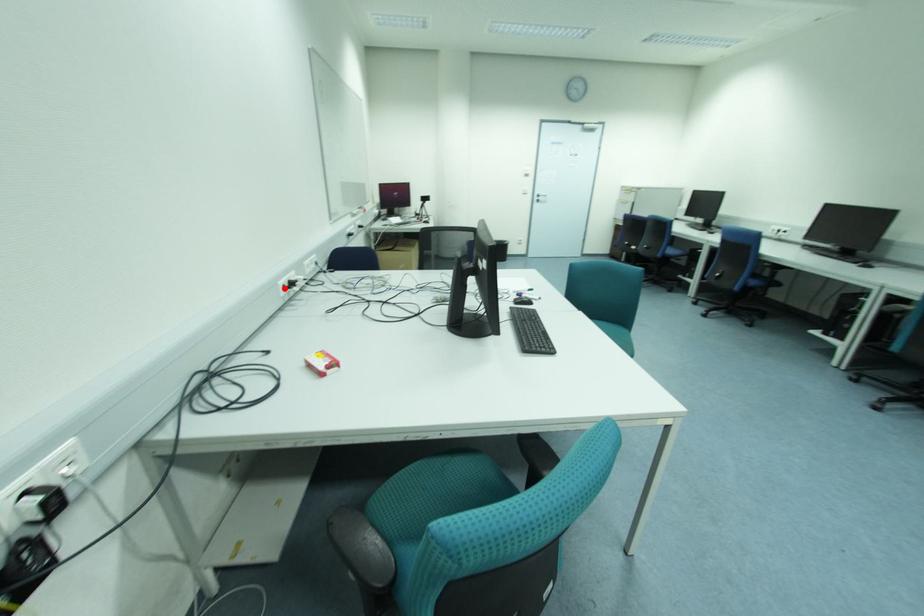
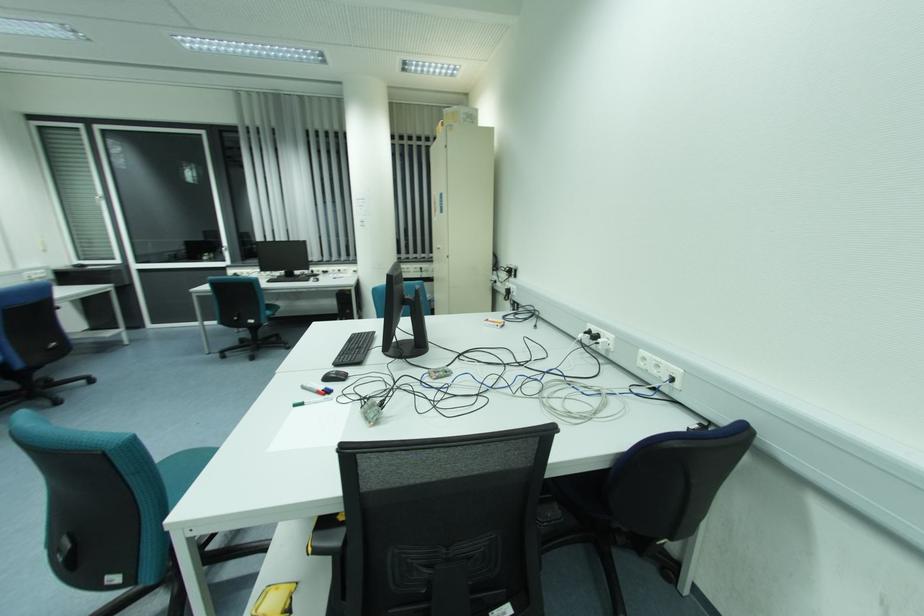
Locate, in the second image, the point that corresponds to the highlighted location in the first image.

(590, 333)